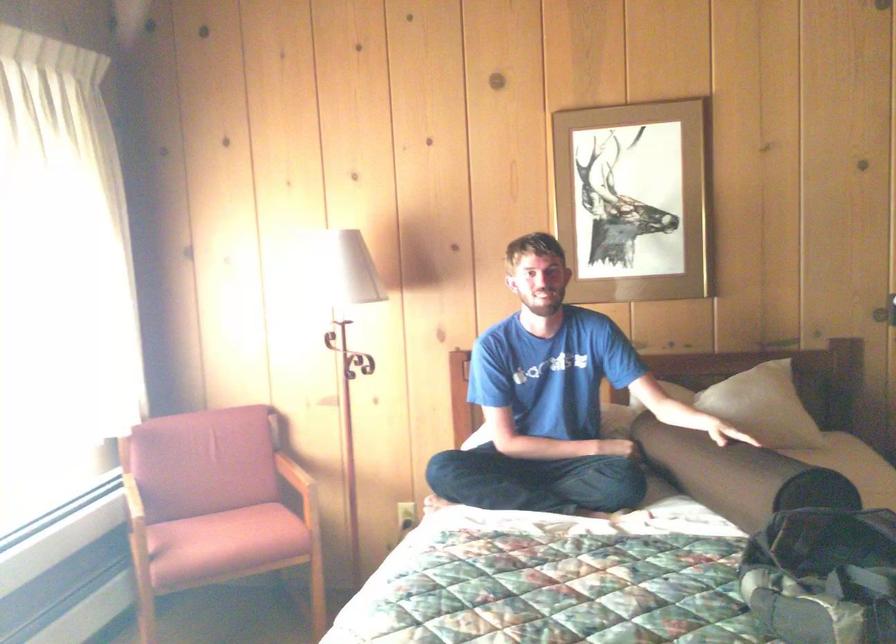
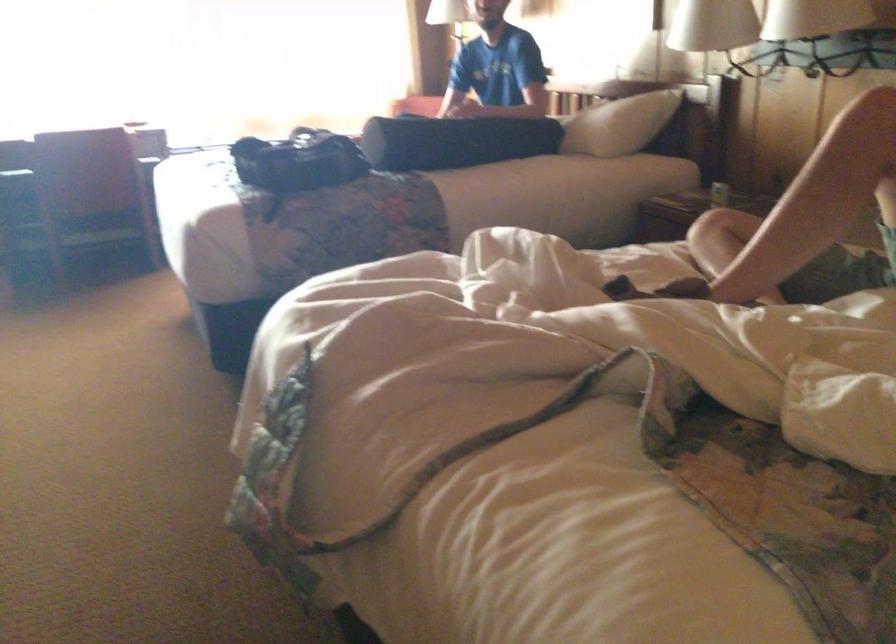
Question: I am providing you with two images of the same scene from different viewpoints. Which of the following objects are not visible in image2?

Choices:
 (A) beverage can
 (B) cream-colored curtain
 (C) off-white pillow
 (D) black bolster pillow

Answer: (C)